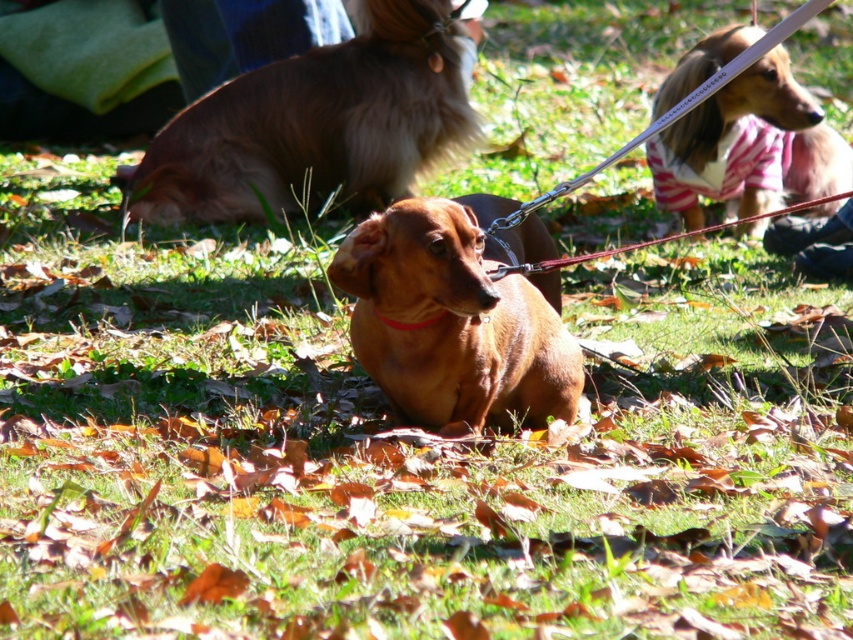
You are standing in the autumn scene with two points marked in the image. Point A is at coordinates point (x=483, y=420) and Point B is at point (x=704, y=65). Which point is closer to you?

Point A at point (x=483, y=420) is closer to the viewer than point B at point (x=704, y=65).

You are a photographer trying to capture a group photo of the two dogs mentioned in the scene. Given that the brown shiny dog at center is shorter than the brown fur dog at center, how should you position them to ensure both are fully visible in the photo?

To ensure both the brown shiny dog at center and the brown fur dog at center are fully visible in the photo, position the shorter brown shiny dog at center closer to the camera and the taller brown fur dog at center slightly behind. This arrangement will help avoid one blocking the other due to their height difference.